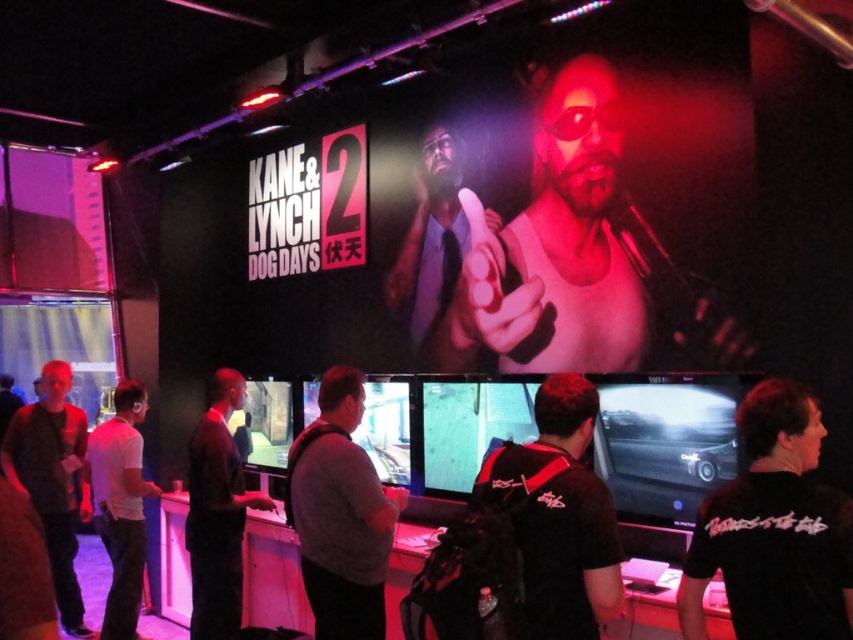
Which is more to the left, black matte t-shirt at center or dark gray shirt at center?

dark gray shirt at center

Between black matte t-shirt at center and dark gray shirt at center, which one appears on the right side from the viewer's perspective?

From the viewer's perspective, black matte t-shirt at center appears more on the right side.

Identify the location of black matte t-shirt at center. (773, 529).

I want to click on black matte t-shirt at center, so click(x=773, y=529).

The height and width of the screenshot is (640, 853). In order to click on black matte t-shirt at center in this screenshot , I will do `click(773, 529)`.

Is point (737, 513) closer to viewer compared to point (660, 412)?

Yes, it is.

Locate an element on the screen. black matte t-shirt at center is located at coordinates (773, 529).

From the picture: Is black matte t-shirt at center bigger than matte black tie at upper center?

Actually, black matte t-shirt at center might be smaller than matte black tie at upper center.

Where is `black matte t-shirt at center`? Image resolution: width=853 pixels, height=640 pixels. black matte t-shirt at center is located at coordinates (773, 529).